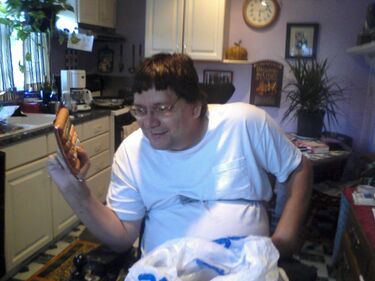
At what (x,y) coordinates should I click in order to perform the action: click on coffee machine. Please return your answer as a coordinate pair (x, y). This screenshot has height=281, width=375. Looking at the image, I should click on (67, 83).